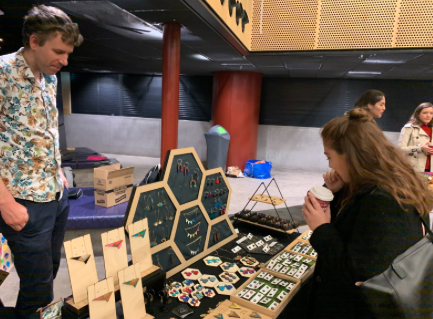
Where is `black table covering`? black table covering is located at coordinates (79, 311).